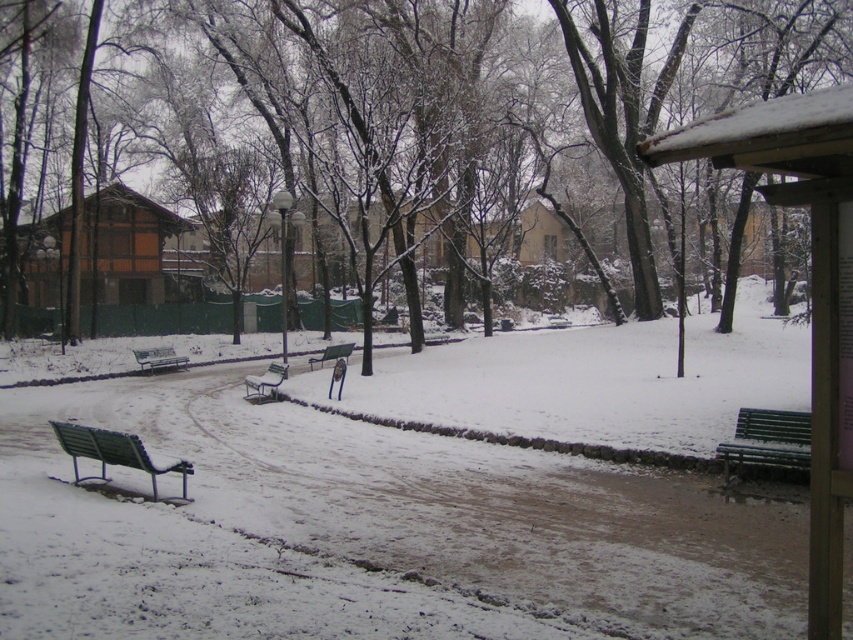
You are a parent trying to decide which bench to sit on with your child. The wooden bench at right and the green painted wood bench at lower right are both available. Which bench is taller?

The wooden bench at right is much taller than the green painted wood bench at lower right.

You are a person walking along the pathway in the winter scene and want to sit on the nearest bench. Which bench should you choose between the wooden bench at right and the green painted wood bench at lower right?

The wooden bench at right is in front of the green painted wood bench at lower right, so it is closer to you. You should choose the wooden bench at right.

You are planning to take a walk in the park and want to rest on one of the benches. You see a wooden bench at right and a metallic silver bench at center. Which bench is located to the right side of the other?

The wooden bench at right is to the right of the metallic silver bench at center.